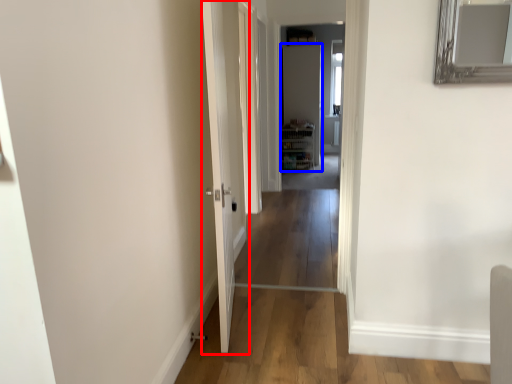
Question: Which of the following is the closest to the observer, door (highlighted by a red box) or door (highlighted by a blue box)?

Choices:
 (A) door
 (B) door

Answer: (A)